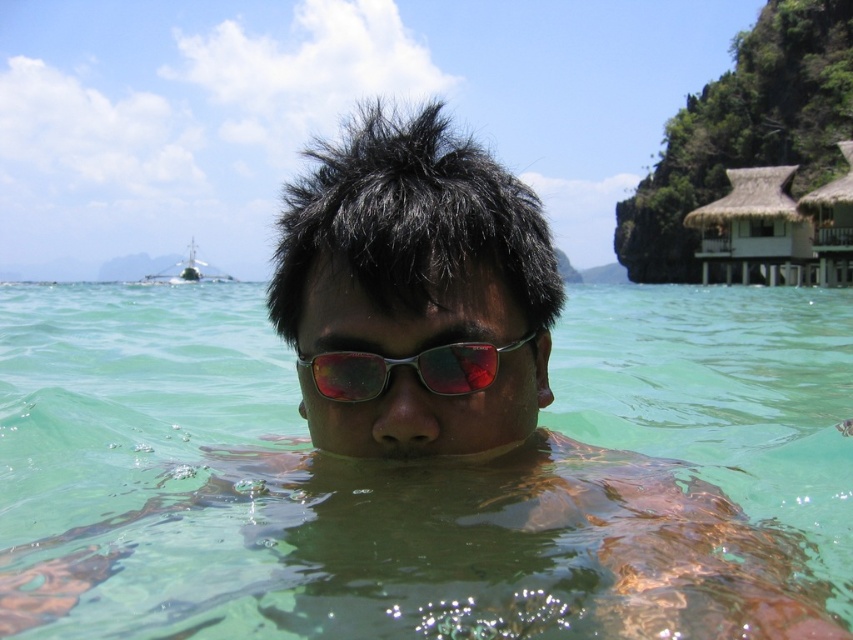
You are standing at the center of the image and want to locate the point at coordinates point (753, 227). Based on the scene description, which object is this point located on?

The point at coordinates point (753, 227) is located on the white thatch hut at upper right.

You are standing at the shore and want to swim towards the boat in the background. There are two points marked in the water. Which point is closer to you, point at coordinates (808, 266) or point at coordinates (349, 384)?

Point at coordinates (349, 384) is closer to you because it is less further to the viewer than point at coordinates (808, 266), which is further away.